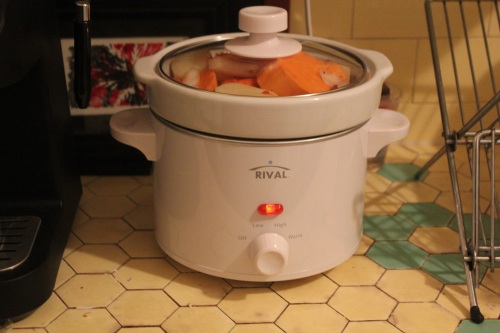
The width and height of the screenshot is (500, 333). I want to click on cooking equipment, so click(305, 175).